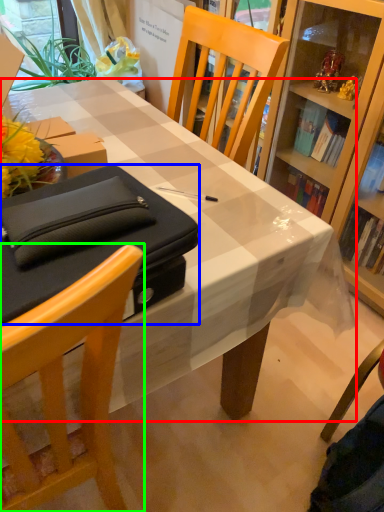
Question: Which is farther away from desk (highlighted by a red box)? box (highlighted by a blue box) or chair (highlighted by a green box)?

Choices:
 (A) box
 (B) chair

Answer: (B)